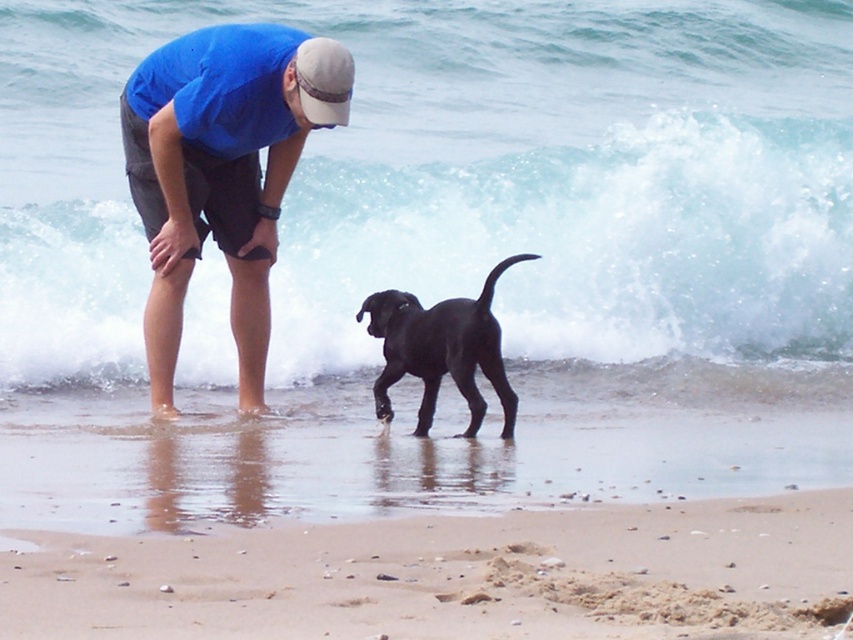
Question: Based on their relative distances, which object is farther from the black matte dog at center?

Choices:
 (A) sandy at lower center
 (B) blue fabric shirt at center

Answer: (A)

Question: Does sandy at lower center have a greater width compared to blue fabric shirt at center?

Choices:
 (A) no
 (B) yes

Answer: (B)

Question: Considering the real-world distances, which object is farthest from the black matte dog at center?

Choices:
 (A) blue fabric shirt at center
 (B) white fabric baseball cap at upper center

Answer: (B)

Question: Can you confirm if blue fabric shirt at center is positioned above black matte dog at center?

Choices:
 (A) yes
 (B) no

Answer: (A)

Question: Considering the real-world distances, which object is closest to the blue fabric shirt at center?

Choices:
 (A) white fabric baseball cap at upper center
 (B) black matte dog at center

Answer: (A)

Question: Can you confirm if blue fabric shirt at center is smaller than black matte dog at center?

Choices:
 (A) yes
 (B) no

Answer: (B)